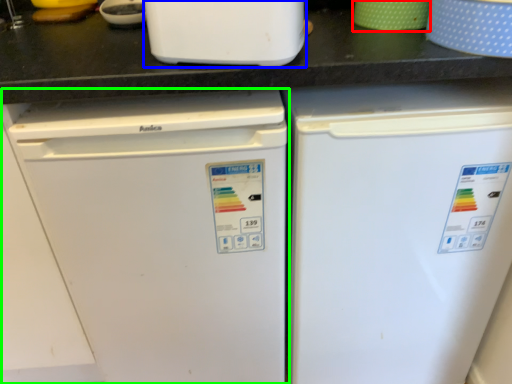
Question: Which object is the farthest from appliance (highlighted by a red box)? Choose among these: home appliance (highlighted by a blue box) or refrigerator (highlighted by a green box).

Choices:
 (A) home appliance
 (B) refrigerator

Answer: (B)